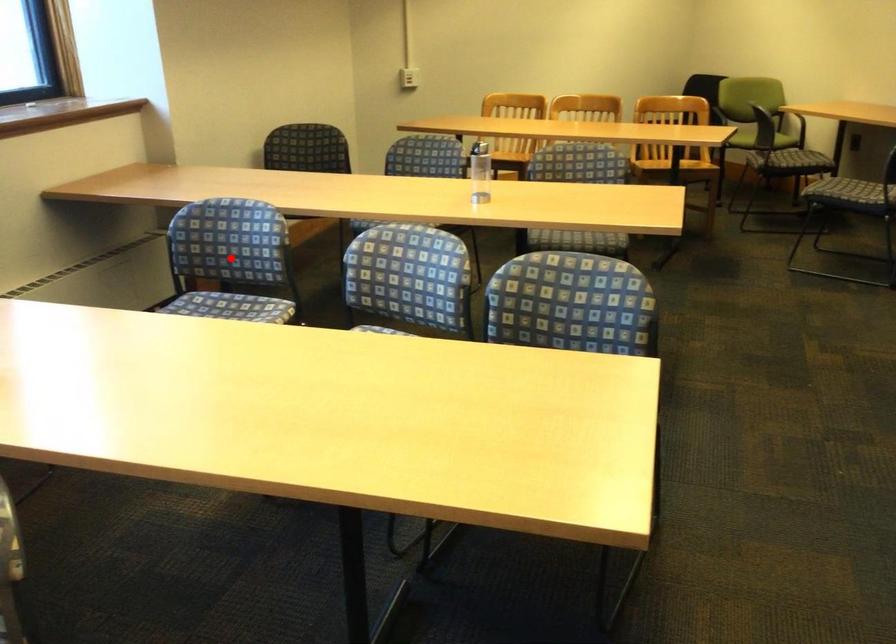
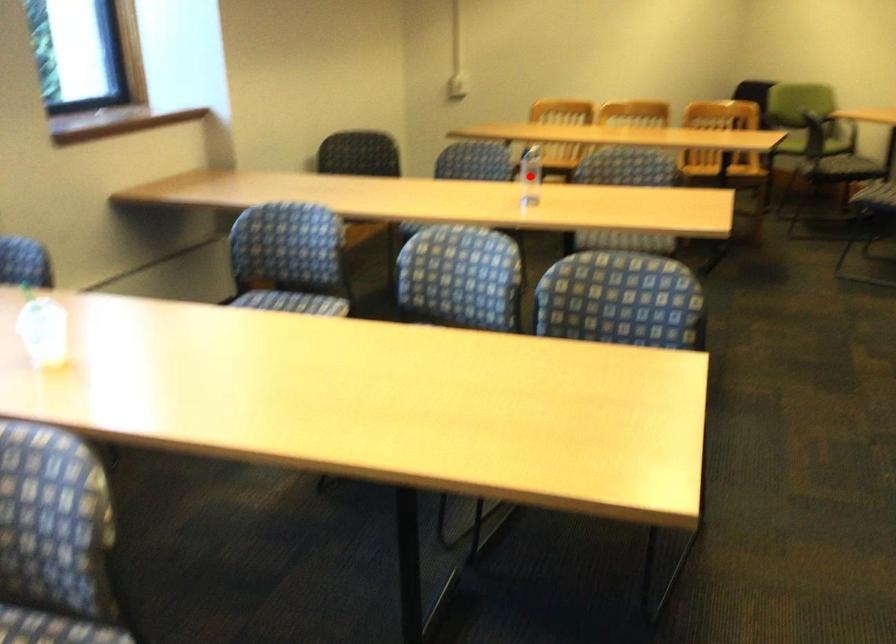
I am providing you with two images of the same scene from different viewpoints. A red point is marked on the first image and another point is marked on the second image. Does the point marked in image1 correspond to the same location as the one in image2?

No